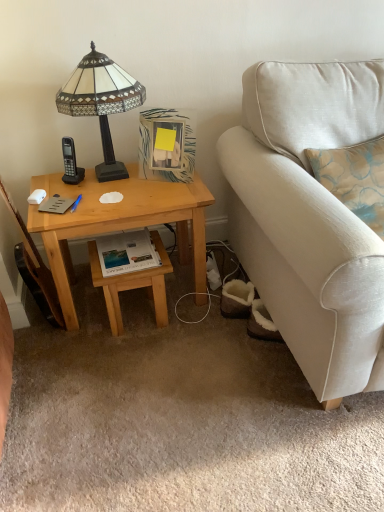
Question: Considering the relative positions of white glossy book at center and beige fabric couch at right in the image provided, is white glossy book at center behind beige fabric couch at right?

Choices:
 (A) no
 (B) yes

Answer: (B)

Question: Is there a large distance between white glossy book at center and beige fabric couch at right?

Choices:
 (A) yes
 (B) no

Answer: (B)

Question: Can you confirm if white glossy book at center is positioned to the right of beige fabric couch at right?

Choices:
 (A) yes
 (B) no

Answer: (B)

Question: From a real-world perspective, is white glossy book at center positioned over beige fabric couch at right based on gravity?

Choices:
 (A) no
 (B) yes

Answer: (A)

Question: Is white glossy book at center oriented away from beige fabric couch at right?

Choices:
 (A) no
 (B) yes

Answer: (A)

Question: From a real-world perspective, relative to beige fabric couch at right, is white glossy book at center vertically above or below?

Choices:
 (A) above
 (B) below

Answer: (B)

Question: Is point (97, 245) closer or farther from the camera than point (339, 80)?

Choices:
 (A) closer
 (B) farther

Answer: (B)

Question: Considering the positions of white glossy book at center and beige fabric couch at right in the image, is white glossy book at center taller or shorter than beige fabric couch at right?

Choices:
 (A) short
 (B) tall

Answer: (A)

Question: Relative to beige fabric couch at right, is white glossy book at center in front or behind?

Choices:
 (A) front
 (B) behind

Answer: (B)

Question: From their relative heights in the image, would you say light wood stool at lower center is taller or shorter than beige fabric couch at right?

Choices:
 (A) short
 (B) tall

Answer: (A)

Question: Is point (87, 243) closer or farther from the camera than point (278, 159)?

Choices:
 (A) closer
 (B) farther

Answer: (B)

Question: From a real-world perspective, relative to beige fabric couch at right, is light wood stool at lower center vertically above or below?

Choices:
 (A) above
 (B) below

Answer: (B)

Question: Considering the positions of light wood stool at lower center and beige fabric couch at right in the image, is light wood stool at lower center bigger or smaller than beige fabric couch at right?

Choices:
 (A) small
 (B) big

Answer: (A)

Question: Considering the positions of white glossy book at center and light wood desk at left in the image, is white glossy book at center taller or shorter than light wood desk at left?

Choices:
 (A) tall
 (B) short

Answer: (B)

Question: Is point (119, 263) closer or farther from the camera than point (72, 304)?

Choices:
 (A) closer
 (B) farther

Answer: (A)